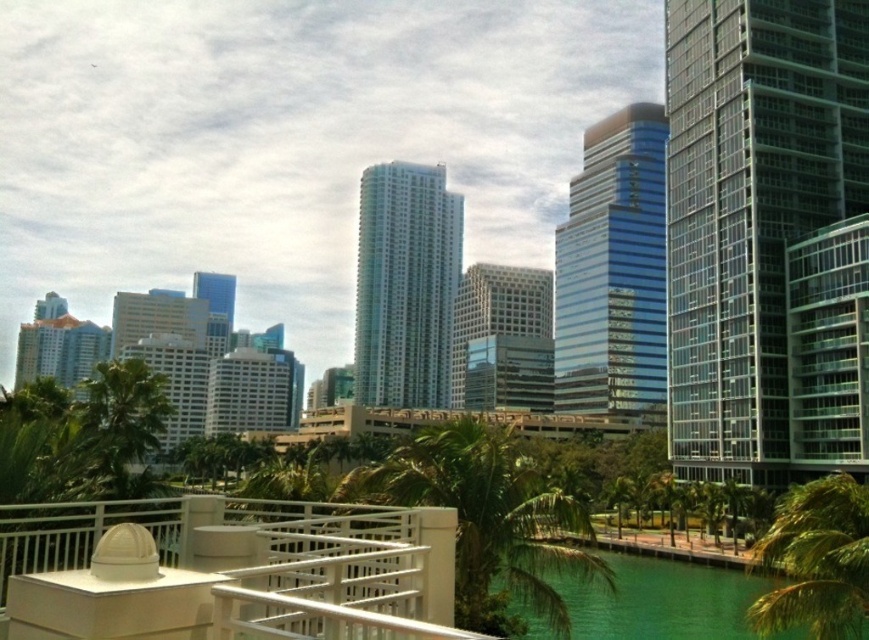
Based on the photo, you are standing on a balcony and see two green leafy palm trees in the scene. Which one is closer to you, the green leafy palm tree at center or the green leafy palm tree at lower right?

The green leafy palm tree at center is closer to you because it is located above the green leafy palm tree at lower right, indicating it is positioned in front of the other.